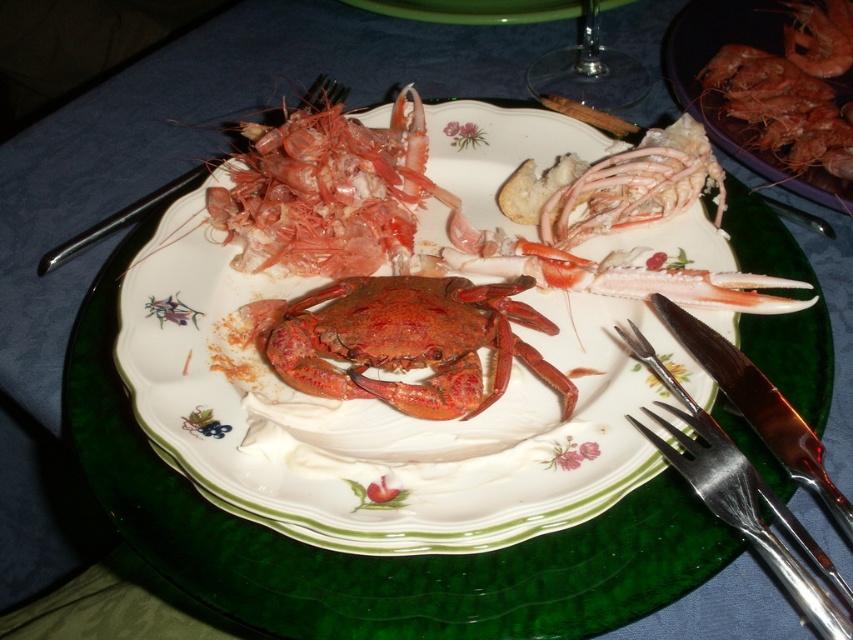
Is white porcelain plate at center bigger than shiny pink shrimp at upper right?

Yes.

Is point (384, 470) positioned before point (845, 65)?

Yes, point (384, 470) is in front of point (845, 65).

The width and height of the screenshot is (853, 640). I want to click on white porcelain plate at center, so click(x=378, y=413).

Between shiny red crab at center and shiny pink shrimp at upper right, which one has less height?

shiny red crab at center is shorter.

Is point (479, 316) closer to camera compared to point (834, 3)?

Yes, point (479, 316) is closer to viewer.

Where is `shiny red crab at center`? The width and height of the screenshot is (853, 640). shiny red crab at center is located at coordinates (410, 342).

Does shiny pink shrimp at upper right have a smaller size compared to metallic silver fork at upper left?

Yes.

Who is lower down, shiny pink shrimp at upper right or metallic silver fork at upper left?

metallic silver fork at upper left is lower down.

Where is `shiny pink shrimp at upper right`? shiny pink shrimp at upper right is located at coordinates (820, 36).